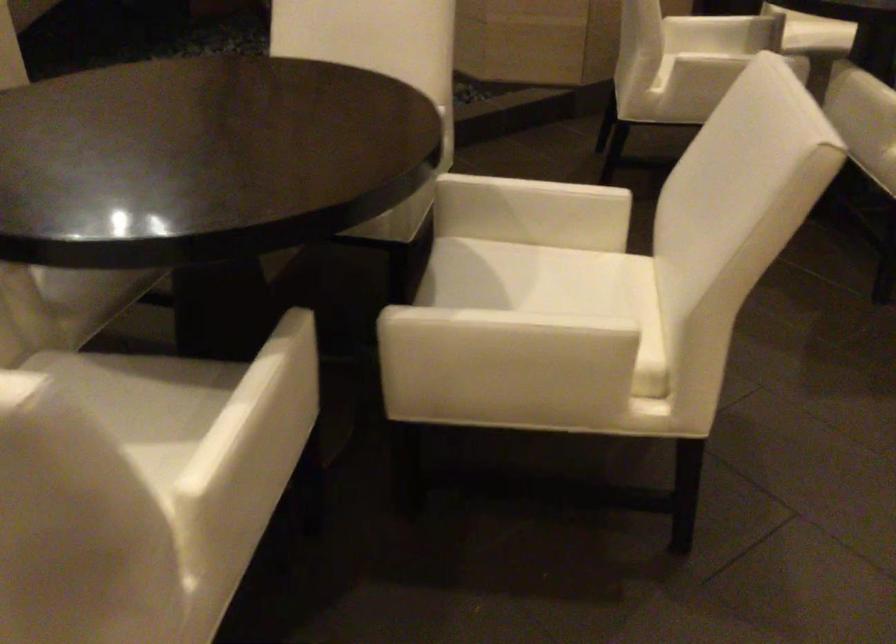
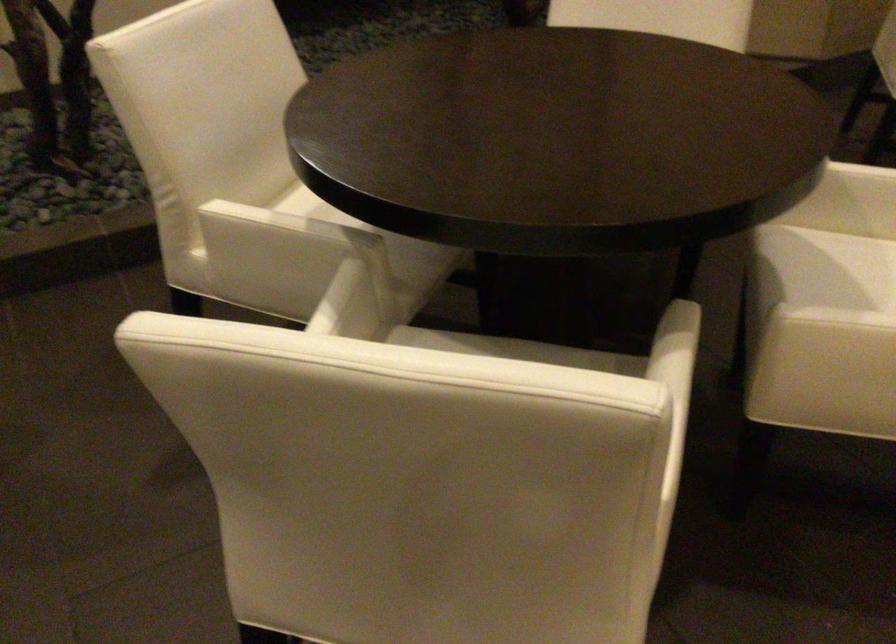
Locate, in the second image, the point that corresponds to pixel 288 355 in the first image.

(688, 353)